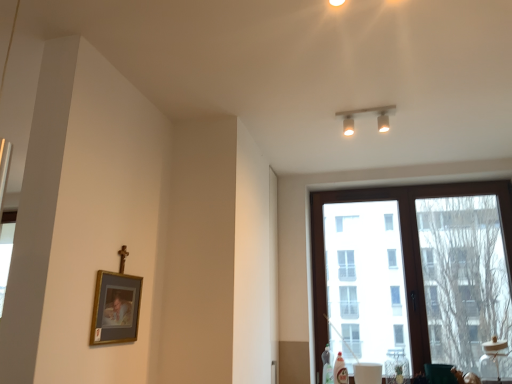
Question: Considering the relative positions of matte white track lights at upper center and gold-framed picture at lower left in the image provided, is matte white track lights at upper center behind gold-framed picture at lower left?

Choices:
 (A) yes
 (B) no

Answer: (A)

Question: Is matte white track lights at upper center not near gold-framed picture at lower left?

Choices:
 (A) no
 (B) yes

Answer: (B)

Question: Does matte white track lights at upper center have a greater height compared to gold-framed picture at lower left?

Choices:
 (A) no
 (B) yes

Answer: (A)

Question: Is matte white track lights at upper center to the right of gold-framed picture at lower left from the viewer's perspective?

Choices:
 (A) yes
 (B) no

Answer: (A)

Question: Is matte white track lights at upper center smaller than gold-framed picture at lower left?

Choices:
 (A) yes
 (B) no

Answer: (B)

Question: Considering the relative positions of brown wooden window at right and gold-framed picture at lower left in the image provided, is brown wooden window at right to the left or to the right of gold-framed picture at lower left?

Choices:
 (A) left
 (B) right

Answer: (B)

Question: From the image's perspective, relative to gold-framed picture at lower left, is brown wooden window at right above or below?

Choices:
 (A) above
 (B) below

Answer: (B)

Question: In terms of height, does brown wooden window at right look taller or shorter compared to gold-framed picture at lower left?

Choices:
 (A) tall
 (B) short

Answer: (A)

Question: Is brown wooden window at right in front of or behind gold-framed picture at lower left in the image?

Choices:
 (A) front
 (B) behind

Answer: (B)

Question: Is gold-framed picture at lower left inside or outside of matte white track lights at upper center?

Choices:
 (A) outside
 (B) inside

Answer: (A)

Question: Visually, is gold-framed picture at lower left positioned to the left or to the right of matte white track lights at upper center?

Choices:
 (A) left
 (B) right

Answer: (A)

Question: From the image's perspective, is gold-framed picture at lower left above or below matte white track lights at upper center?

Choices:
 (A) below
 (B) above

Answer: (A)

Question: Is gold-framed picture at lower left bigger or smaller than matte white track lights at upper center?

Choices:
 (A) small
 (B) big

Answer: (A)

Question: In terms of width, does brown wooden window at right look wider or thinner when compared to matte white track lights at upper center?

Choices:
 (A) thin
 (B) wide

Answer: (B)

Question: From the image's perspective, is brown wooden window at right above or below matte white track lights at upper center?

Choices:
 (A) above
 (B) below

Answer: (B)